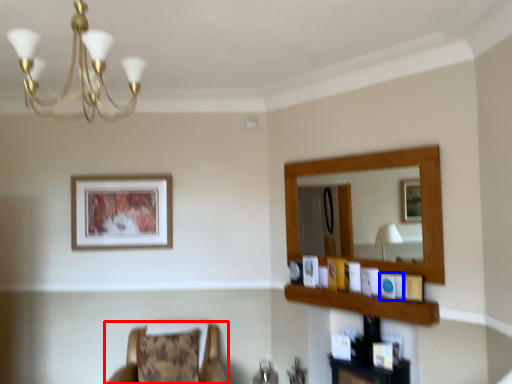
Question: Among these objects, which one is farthest to the camera, chair (highlighted by a red box) or picture frame (highlighted by a blue box)?

Choices:
 (A) chair
 (B) picture frame

Answer: (B)